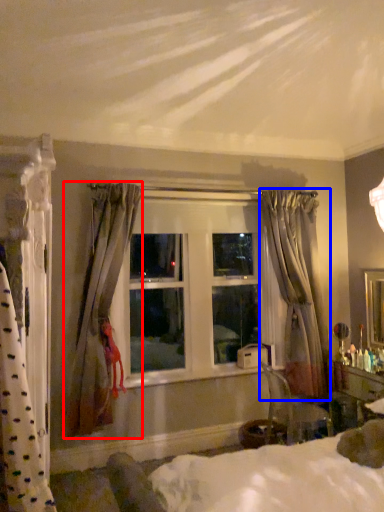
Question: Which of the following is the closest to the observer, curtain (highlighted by a red box) or curtain (highlighted by a blue box)?

Choices:
 (A) curtain
 (B) curtain

Answer: (A)